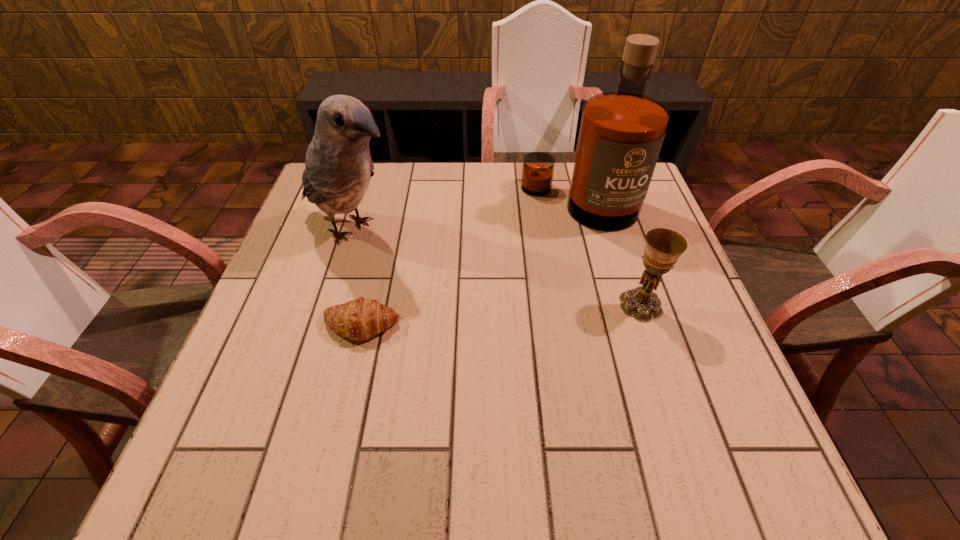
Locate an element on the screen. free space located 0.210m on the front label of the liquor is located at coordinates (533, 286).

Where is `free spot located 0.310m on the front label of the liquor`? free spot located 0.310m on the front label of the liquor is located at coordinates (517, 318).

The height and width of the screenshot is (540, 960). In order to click on parrot that is at the far edge in this screenshot , I will do `click(338, 167)`.

Where is `liquor that is at the far edge`? The image size is (960, 540). liquor that is at the far edge is located at coordinates (621, 133).

Identify the location of crescent roll positioned at the left edge. This screenshot has height=540, width=960. (360, 319).

This screenshot has width=960, height=540. Identify the location of parrot positioned at the left edge. (338, 167).

Locate an element on the screen. The image size is (960, 540). chalice that is at the right edge is located at coordinates click(x=663, y=247).

At what (x,y) coordinates should I click in order to perform the action: click on liquor at the right edge. Please return your answer as a coordinate pair (x, y). Looking at the image, I should click on (621, 133).

Locate an element on the screen. This screenshot has width=960, height=540. object at the far left corner is located at coordinates (338, 167).

Identify the location of object that is at the far right corner. Image resolution: width=960 pixels, height=540 pixels. (621, 133).